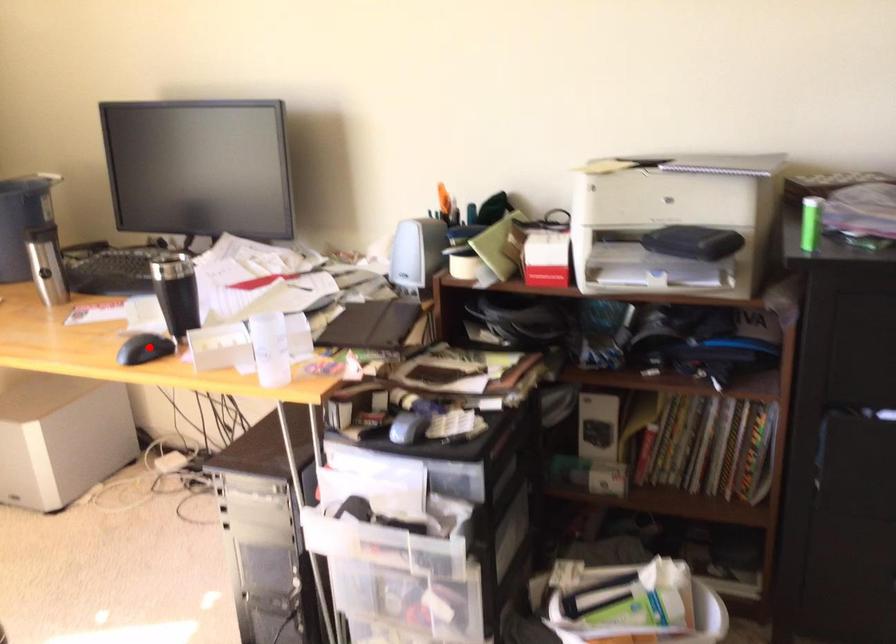
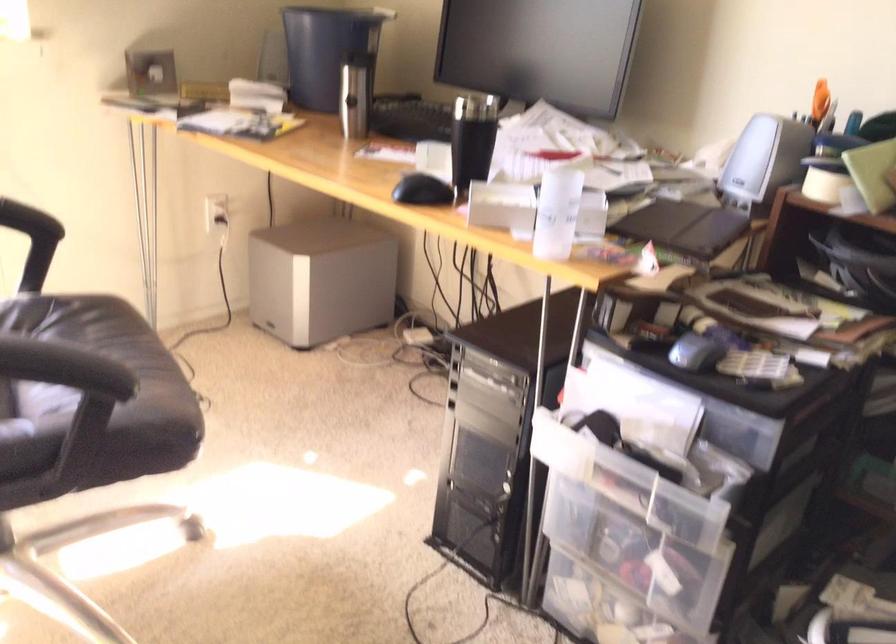
Find the pixel in the second image that matches the highlighted location in the first image.

(421, 190)